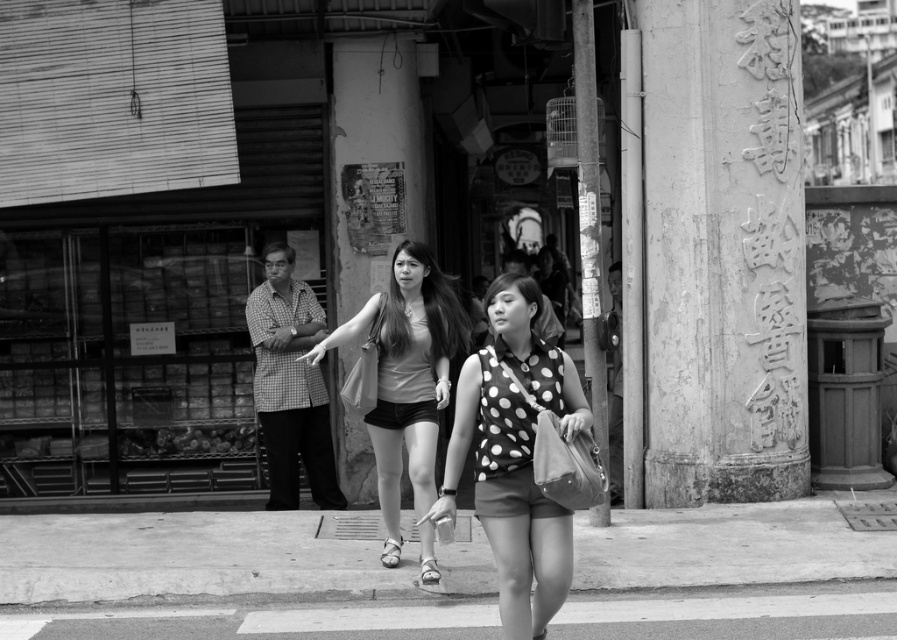
You are a photographer trying to capture a shot of the polka dot fabric top at center and the smooth stone pillar at right. Based on their positions, which object is closer to the left edge of the photo?

The polka dot fabric top at center is closer to the left edge of the photo because it is positioned on the left side of the smooth stone pillar at right.

Based on the scene described, which object is taller between the weathered stone pillar at right and the matte gray tank top at center?

The weathered stone pillar at right is taller than the matte gray tank top at center.

You are a photographer analyzing the composition of this black and white photo. You want to know where the polka dot fabric top at center is located in terms of coordinates. What are its coordinates?

The polka dot fabric top at center is located at coordinates point [515,456].